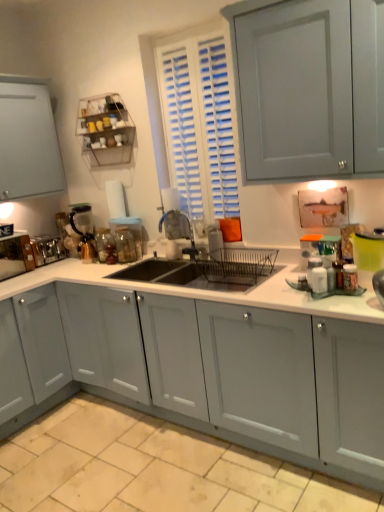
Question: Is white matte countertop at center oriented away from clear glass jar at sink, the 1th appliance when ordered from right to left?

Choices:
 (A) yes
 (B) no

Answer: (B)

Question: Can you confirm if white matte countertop at center is wider than clear glass jar at sink, placed as the fourth appliance when sorted from left to right?

Choices:
 (A) yes
 (B) no

Answer: (A)

Question: From the image's perspective, is white matte countertop at center on top of clear glass jar at sink, placed as the fourth appliance when sorted from left to right?

Choices:
 (A) yes
 (B) no

Answer: (B)

Question: Does white matte countertop at center turn towards clear glass jar at sink, the 1th appliance when ordered from right to left?

Choices:
 (A) yes
 (B) no

Answer: (B)

Question: Can we say white matte countertop at center lies outside clear glass jar at sink, placed as the fourth appliance when sorted from left to right?

Choices:
 (A) no
 (B) yes

Answer: (B)

Question: Considering their positions, is clear glass jar at sink, placed as the fourth appliance when sorted from left to right, located in front of or behind translucent glass coffee maker at left, which is the second appliance from right to left?

Choices:
 (A) behind
 (B) front

Answer: (B)

Question: From a real-world perspective, is clear glass jar at sink, the 1th appliance when ordered from right to left, positioned above or below translucent glass coffee maker at left, acting as the 3th appliance starting from the left?

Choices:
 (A) below
 (B) above

Answer: (A)

Question: In the image, is clear glass jar at sink, the 1th appliance when ordered from right to left, on the left side or the right side of translucent glass coffee maker at left, which is the second appliance from right to left?

Choices:
 (A) right
 (B) left

Answer: (A)

Question: Based on their sizes in the image, would you say clear glass jar at sink, the 1th appliance when ordered from right to left, is bigger or smaller than translucent glass coffee maker at left, acting as the 3th appliance starting from the left?

Choices:
 (A) small
 (B) big

Answer: (A)

Question: Does point (54, 252) appear closer or farther from the camera than point (112, 224)?

Choices:
 (A) farther
 (B) closer

Answer: (A)

Question: From their relative heights in the image, would you say satin silver toaster at left, the second appliance from the left, is taller or shorter than clear glass jar at sink, the 1th appliance when ordered from right to left?

Choices:
 (A) tall
 (B) short

Answer: (B)

Question: From a real-world perspective, is satin silver toaster at left, which is the 3th appliance from right to left, physically located above or below clear glass jar at sink, the 1th appliance when ordered from right to left?

Choices:
 (A) below
 (B) above

Answer: (A)

Question: Is satin silver toaster at left, the second appliance from the left, situated inside clear glass jar at sink, placed as the fourth appliance when sorted from left to right, or outside?

Choices:
 (A) inside
 (B) outside

Answer: (B)

Question: Relative to metallic silver toaster at left, the first appliance when ordered from left to right, is clear glass jar at sink, placed as the fourth appliance when sorted from left to right, in front or behind?

Choices:
 (A) front
 (B) behind

Answer: (B)

Question: Considering the positions of clear glass jar at sink, placed as the fourth appliance when sorted from left to right, and metallic silver toaster at left, the first appliance when ordered from left to right, in the image, is clear glass jar at sink, placed as the fourth appliance when sorted from left to right, bigger or smaller than metallic silver toaster at left, the first appliance when ordered from left to right,?

Choices:
 (A) small
 (B) big

Answer: (A)